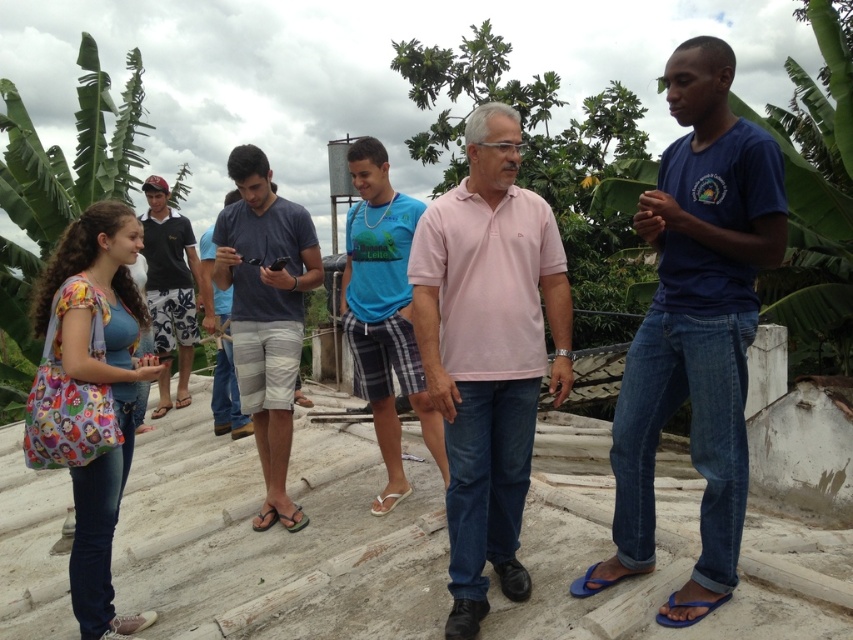
Question: From the image, what is the correct spatial relationship of green leafy banana tree at left in relation to blue plaid shorts at center?

Choices:
 (A) above
 (B) below

Answer: (A)

Question: Can you confirm if matte blue shirt at center is wider than white fabric sandal at center?

Choices:
 (A) yes
 (B) no

Answer: (A)

Question: Which of the following is the farthest from the observer?

Choices:
 (A) (224, 362)
 (B) (521, 483)
 (C) (283, 484)

Answer: (A)

Question: Considering the real-world distances, which object is farthest from the dark blue shirt at left?

Choices:
 (A) blue denim jeans at center
 (B) matte blue shirt at center
 (C) pink cotton polo shirt at center

Answer: (A)

Question: Estimate the real-world distances between objects in this image. Which object is farther from the dark blue cotton shirt at center?

Choices:
 (A) white fabric sandal at center
 (B) blue denim jeans at center
 (C) dark blue shirt at left

Answer: (C)

Question: Does dark blue shirt at left have a lesser width compared to white fabric sandal at center?

Choices:
 (A) no
 (B) yes

Answer: (A)